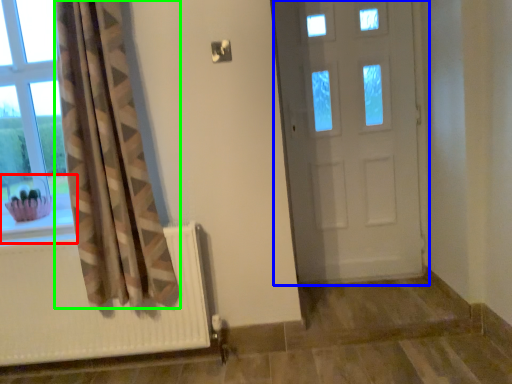
Question: Based on their relative distances, which object is nearer to window sill (highlighted by a red box)? Choose from door (highlighted by a blue box) and curtain (highlighted by a green box).

Choices:
 (A) door
 (B) curtain

Answer: (B)